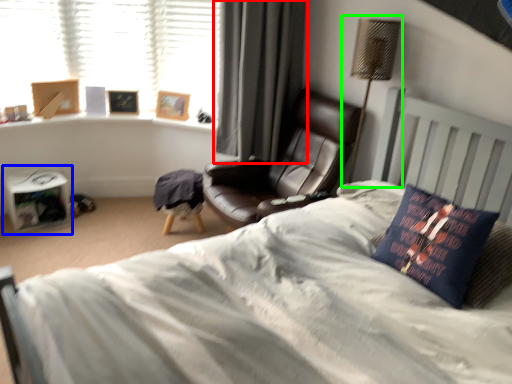
Question: Which is nearer to the curtain (highlighted by a red box)? paperback book (highlighted by a blue box) or table lamp (highlighted by a green box).

Choices:
 (A) paperback book
 (B) table lamp

Answer: (B)